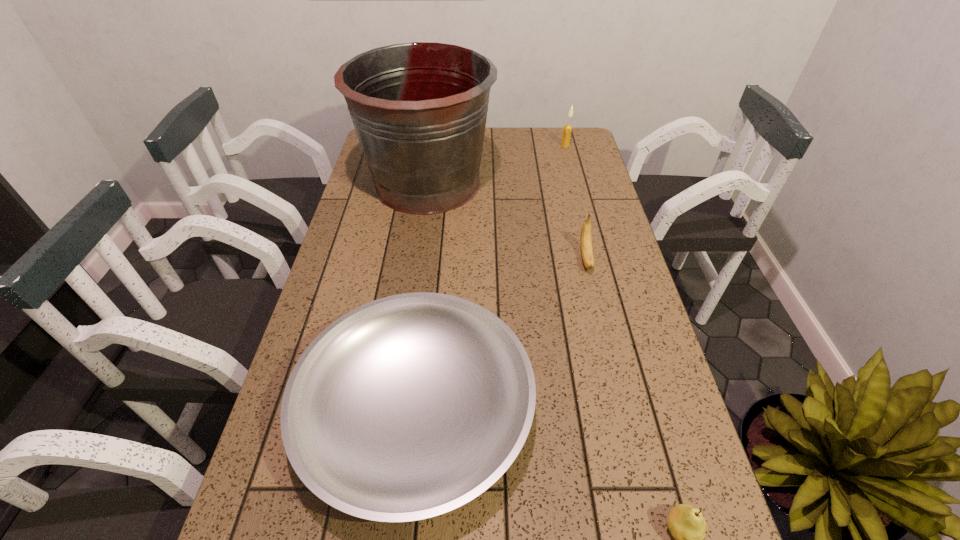
The height and width of the screenshot is (540, 960). I want to click on bucket, so click(419, 109).

Where is `the fourth shortest object`? the fourth shortest object is located at coordinates (567, 130).

The width and height of the screenshot is (960, 540). Find the location of `banana`. banana is located at coordinates (586, 238).

Identify the location of the third tallest object. Image resolution: width=960 pixels, height=540 pixels. (586, 238).

The image size is (960, 540). I want to click on bedpan, so click(408, 407).

Identify the location of vacant region located 0.340m on the front of the tallest object. The width and height of the screenshot is (960, 540). (409, 311).

I want to click on free space located on the left of the candle, so click(x=530, y=145).

Find the location of `vacant area located 0.070m at the start of the peel on the third nearest object`. vacant area located 0.070m at the start of the peel on the third nearest object is located at coordinates (595, 295).

Identify the location of free space located on the back of the bedpan. The height and width of the screenshot is (540, 960). (431, 270).

You are a GUI agent. You are given a task and a screenshot of the screen. Output one action in this format:
    pyautogui.click(x=<x>, y=<y>)
    Task: Click on the bucket located at the far edge
    This screenshot has width=960, height=540.
    Given the screenshot: What is the action you would take?
    pyautogui.click(x=419, y=109)